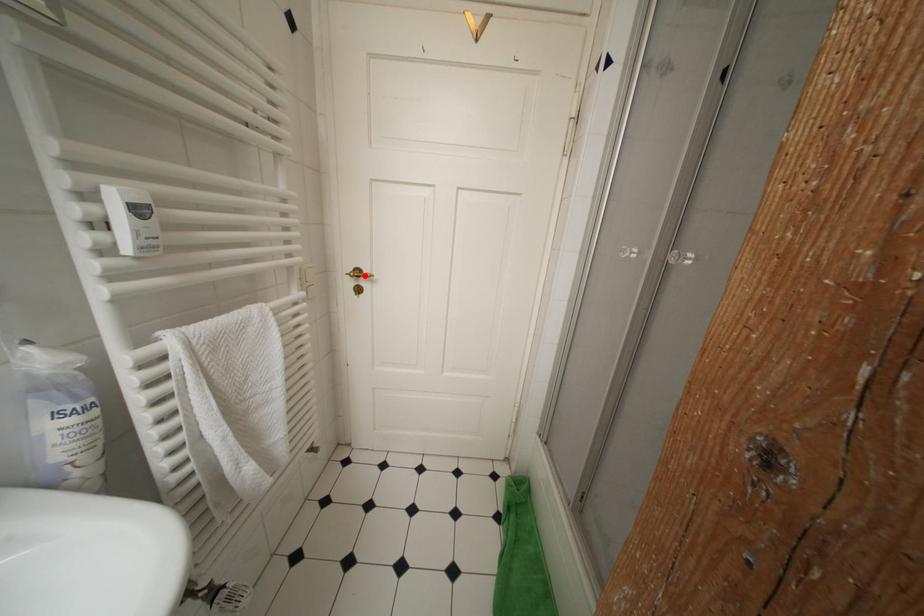
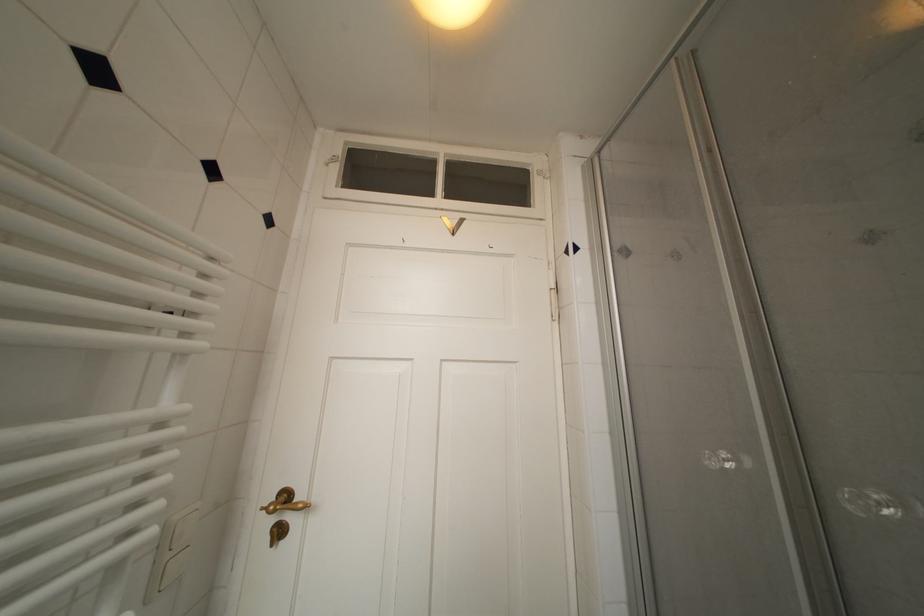
Where in the second image is the point corresponding to the highlighted location from the first image?

(293, 500)